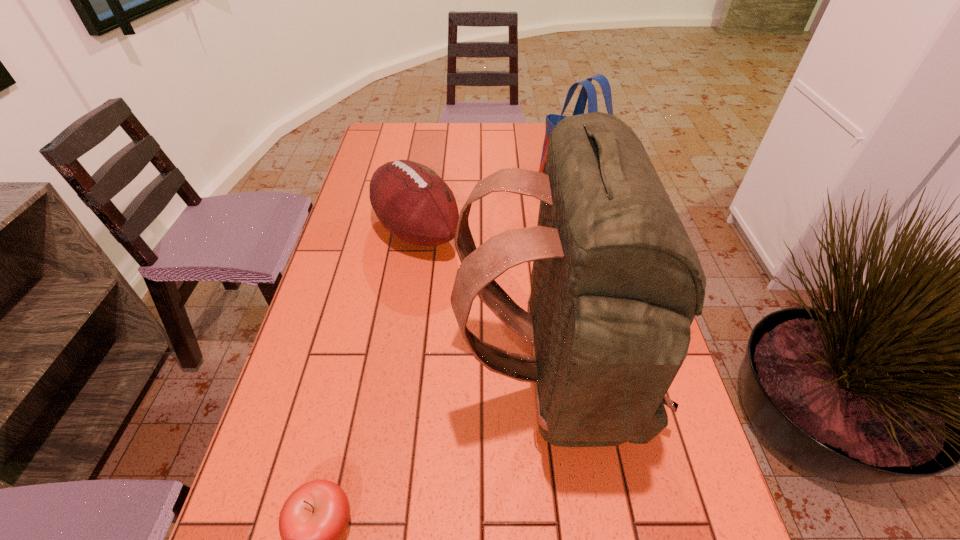
At what (x,y) coordinates should I click in order to perform the action: click on backpack that is at the right edge. Please return your answer as a coordinate pair (x, y). The height and width of the screenshot is (540, 960). Looking at the image, I should click on (616, 282).

Where is `handbag situated at the right edge`? This screenshot has width=960, height=540. handbag situated at the right edge is located at coordinates (588, 91).

Identify the location of vacant space at the far edge of the desktop. (x=529, y=125).

Find the location of a particular element. This screenshot has height=540, width=960. free space at the left edge of the desktop is located at coordinates (340, 414).

This screenshot has width=960, height=540. Identify the location of free space at the right edge. (616, 486).

Locate an element on the screen. free area in between the football (American) and the second nearest object is located at coordinates (486, 307).

In order to click on vacant space that's between the football (American) and the second nearest object in this screenshot , I will do `click(486, 307)`.

At what (x,y) coordinates should I click in order to perform the action: click on object that is the third nearest to the shortest object. Please return your answer as a coordinate pair (x, y). Looking at the image, I should click on (588, 91).

Where is `object identified as the closest to the third tallest object`? Image resolution: width=960 pixels, height=540 pixels. object identified as the closest to the third tallest object is located at coordinates (616, 282).